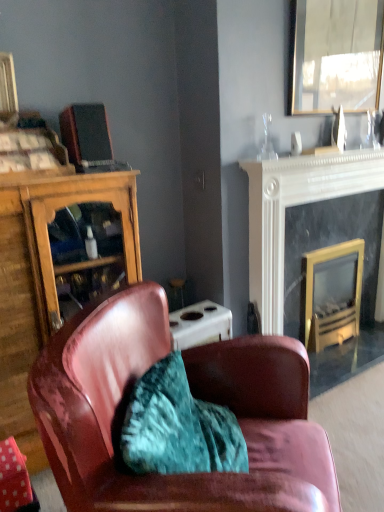
In order to face metallic reflective mirror at upper right, should I rotate leftwards or rightwards?

Rotate right and turn 19.459 degrees.

The width and height of the screenshot is (384, 512). Describe the element at coordinates (337, 55) in the screenshot. I see `metallic reflective mirror at upper right` at that location.

The image size is (384, 512). What are the coordinates of `leather armchair at center` in the screenshot? It's located at (194, 395).

Image resolution: width=384 pixels, height=512 pixels. In order to click on matte black speaker at upper left in this screenshot , I will do coord(88,138).

This screenshot has width=384, height=512. Describe the element at coordinates (46, 280) in the screenshot. I see `wooden cabinet at left` at that location.

The height and width of the screenshot is (512, 384). What do you see at coordinates (310, 226) in the screenshot?
I see `black marble fireplace at upper right, placed as the 2th fireplace when sorted from left to right` at bounding box center [310, 226].

The width and height of the screenshot is (384, 512). In order to click on gold-framed glass fireplace at right, marked as the 1th fireplace in a left-to-right arrangement in this screenshot , I will do `click(332, 294)`.

In terms of height, does matte black speaker at upper left look taller or shorter compared to black marble fireplace at upper right, placed as the 2th fireplace when sorted from left to right?

Considering their sizes, matte black speaker at upper left has less height than black marble fireplace at upper right, placed as the 2th fireplace when sorted from left to right.

Between point (97, 159) and point (332, 354), which one is positioned in front?

The point (97, 159) is in front.

How many degrees apart are the facing directions of matte black speaker at upper left and black marble fireplace at upper right, placed as the 1th fireplace when sorted from right to left?

3.03 degrees.

You are a GUI agent. You are given a task and a screenshot of the screen. Output one action in this format:
    pyautogui.click(x=<x>, y=<y>)
    Task: Click on the laptop on the left of black marble fireplace at upper right, placed as the 2th fireplace when sorted from left to right
    
    Given the screenshot: What is the action you would take?
    pyautogui.click(x=88, y=138)

Between gold-framed glass fireplace at right, which is the second fireplace from right to left, and metallic reflective mirror at upper right, which one is positioned in front?

metallic reflective mirror at upper right.

Between gold-framed glass fireplace at right, which is the second fireplace from right to left, and metallic reflective mirror at upper right, which one has more height?

gold-framed glass fireplace at right, which is the second fireplace from right to left.

Considering the positions of point (362, 53) and point (107, 402), is point (362, 53) closer or farther from the camera than point (107, 402)?

Point (362, 53) is positioned farther from the camera compared to point (107, 402).

Which is more to the right, metallic reflective mirror at upper right or leather armchair at center?

metallic reflective mirror at upper right.

Is metallic reflective mirror at upper right bigger or smaller than leather armchair at center?

metallic reflective mirror at upper right is smaller than leather armchair at center.

Is leather armchair at center at the back of metallic reflective mirror at upper right?

That's not correct — metallic reflective mirror at upper right is not looking away from leather armchair at center.

Is metallic reflective mirror at upper right placed right next to gold-framed glass fireplace at right, marked as the 1th fireplace in a left-to-right arrangement?

metallic reflective mirror at upper right and gold-framed glass fireplace at right, marked as the 1th fireplace in a left-to-right arrangement, are not in contact.

Looking at this image, is metallic reflective mirror at upper right wider than gold-framed glass fireplace at right, marked as the 1th fireplace in a left-to-right arrangement?

In fact, metallic reflective mirror at upper right might be narrower than gold-framed glass fireplace at right, marked as the 1th fireplace in a left-to-right arrangement.

From a real-world perspective, between metallic reflective mirror at upper right and gold-framed glass fireplace at right, which is the second fireplace from right to left, who is vertically higher?

metallic reflective mirror at upper right, from a real-world perspective.

Is point (312, 33) in front of point (338, 342)?

Yes, point (312, 33) is closer to viewer.

Is gold-framed glass fireplace at right, marked as the 1th fireplace in a left-to-right arrangement, in front of or behind wooden cabinet at left in the image?

gold-framed glass fireplace at right, marked as the 1th fireplace in a left-to-right arrangement, is positioned farther from the viewer than wooden cabinet at left.

How different are the orientations of gold-framed glass fireplace at right, marked as the 1th fireplace in a left-to-right arrangement, and wooden cabinet at left in degrees?

There is a 1.7-degree angle between the facing directions of gold-framed glass fireplace at right, marked as the 1th fireplace in a left-to-right arrangement, and wooden cabinet at left.

Considering the relative sizes of gold-framed glass fireplace at right, which is the second fireplace from right to left, and wooden cabinet at left in the image provided, is gold-framed glass fireplace at right, which is the second fireplace from right to left, smaller than wooden cabinet at left?

Indeed, gold-framed glass fireplace at right, which is the second fireplace from right to left, has a smaller size compared to wooden cabinet at left.

This screenshot has height=512, width=384. What are the coordinates of `the 2nd fireplace located beneath the wooden cabinet at left (from a real-world perspective)` in the screenshot? It's located at (332, 294).

Is gold-framed glass fireplace at right, marked as the 1th fireplace in a left-to-right arrangement, at the left side of matte black speaker at upper left?

In fact, gold-framed glass fireplace at right, marked as the 1th fireplace in a left-to-right arrangement, is to the right of matte black speaker at upper left.

In the scene shown: Is gold-framed glass fireplace at right, marked as the 1th fireplace in a left-to-right arrangement, beside matte black speaker at upper left?

There is a gap between gold-framed glass fireplace at right, marked as the 1th fireplace in a left-to-right arrangement, and matte black speaker at upper left.

From a real-world perspective, relative to matte black speaker at upper left, is gold-framed glass fireplace at right, marked as the 1th fireplace in a left-to-right arrangement, vertically above or below?

Clearly, from a real-world perspective, gold-framed glass fireplace at right, marked as the 1th fireplace in a left-to-right arrangement, is below matte black speaker at upper left.

Looking at the image, does gold-framed glass fireplace at right, marked as the 1th fireplace in a left-to-right arrangement, seem bigger or smaller compared to matte black speaker at upper left?

gold-framed glass fireplace at right, marked as the 1th fireplace in a left-to-right arrangement, is bigger than matte black speaker at upper left.

Which point is more distant from viewer, (259,281) or (328,42)?

The point (259,281) is farther.

Considering the relative positions of black marble fireplace at upper right, placed as the 1th fireplace when sorted from right to left, and metallic reflective mirror at upper right in the image provided, is black marble fireplace at upper right, placed as the 1th fireplace when sorted from right to left, to the left of metallic reflective mirror at upper right from the viewer's perspective?

Incorrect, black marble fireplace at upper right, placed as the 1th fireplace when sorted from right to left, is not on the left side of metallic reflective mirror at upper right.

From a real-world perspective, is black marble fireplace at upper right, placed as the 1th fireplace when sorted from right to left, below metallic reflective mirror at upper right?

Yes, from a real-world perspective, black marble fireplace at upper right, placed as the 1th fireplace when sorted from right to left, is beneath metallic reflective mirror at upper right.

Can we say black marble fireplace at upper right, placed as the 2th fireplace when sorted from left to right, lies outside metallic reflective mirror at upper right?

Absolutely, black marble fireplace at upper right, placed as the 2th fireplace when sorted from left to right, is external to metallic reflective mirror at upper right.

The height and width of the screenshot is (512, 384). Find the location of `laptop on the left of black marble fireplace at upper right, placed as the 1th fireplace when sorted from right to left`. laptop on the left of black marble fireplace at upper right, placed as the 1th fireplace when sorted from right to left is located at coordinates (88, 138).

From the image's perspective, starting from the metallic reflective mirror at upper right, which fireplace is the 2nd one below? Please provide its 2D coordinates.

[(332, 294)]

Which object lies further to the anchor point metallic reflective mirror at upper right, matte black speaker at upper left or black marble fireplace at upper right, placed as the 1th fireplace when sorted from right to left?

Among the two, matte black speaker at upper left is located further to metallic reflective mirror at upper right.

Considering their positions, is matte black speaker at upper left positioned further to metallic reflective mirror at upper right than gold-framed glass fireplace at right, which is the second fireplace from right to left?

matte black speaker at upper left lies further to metallic reflective mirror at upper right than the other object.

From the picture: Considering their positions, is black marble fireplace at upper right, placed as the 1th fireplace when sorted from right to left, positioned closer to wooden cabinet at left than leather armchair at center?

Based on the image, leather armchair at center appears to be nearer to wooden cabinet at left.

From the image, which object appears to be farther from gold-framed glass fireplace at right, which is the second fireplace from right to left, black marble fireplace at upper right, placed as the 1th fireplace when sorted from right to left, or wooden cabinet at left?

wooden cabinet at left is positioned further to the anchor gold-framed glass fireplace at right, which is the second fireplace from right to left.

Which object lies further to the anchor point leather armchair at center, matte black speaker at upper left or metallic reflective mirror at upper right?

The object further to leather armchair at center is metallic reflective mirror at upper right.

Estimate the real-world distances between objects in this image. Which object is further from wooden cabinet at left, gold-framed glass fireplace at right, which is the second fireplace from right to left, or black marble fireplace at upper right, placed as the 1th fireplace when sorted from right to left?

gold-framed glass fireplace at right, which is the second fireplace from right to left, is positioned further to the anchor wooden cabinet at left.

Considering their positions, is leather armchair at center positioned closer to metallic reflective mirror at upper right than gold-framed glass fireplace at right, marked as the 1th fireplace in a left-to-right arrangement?

Among the two, gold-framed glass fireplace at right, marked as the 1th fireplace in a left-to-right arrangement, is located nearer to metallic reflective mirror at upper right.

From the picture: Based on their spatial positions, is wooden cabinet at left or metallic reflective mirror at upper right closer to leather armchair at center?

The object closer to leather armchair at center is wooden cabinet at left.

Where is `cabinetry that lies between metallic reflective mirror at upper right and leather armchair at center from top to bottom`? The width and height of the screenshot is (384, 512). cabinetry that lies between metallic reflective mirror at upper right and leather armchair at center from top to bottom is located at coordinates (46, 280).

This screenshot has height=512, width=384. Find the location of `fireplace between leather armchair at center and gold-framed glass fireplace at right, which is the second fireplace from right to left, in the front-back direction`. fireplace between leather armchair at center and gold-framed glass fireplace at right, which is the second fireplace from right to left, in the front-back direction is located at coordinates (310, 226).

Image resolution: width=384 pixels, height=512 pixels. What are the coordinates of `mirror between matte black speaker at upper left and gold-framed glass fireplace at right, marked as the 1th fireplace in a left-to-right arrangement` in the screenshot? It's located at (337, 55).

Identify the location of fireplace between wooden cabinet at left and black marble fireplace at upper right, placed as the 1th fireplace when sorted from right to left, from left to right. This screenshot has width=384, height=512. (332, 294).